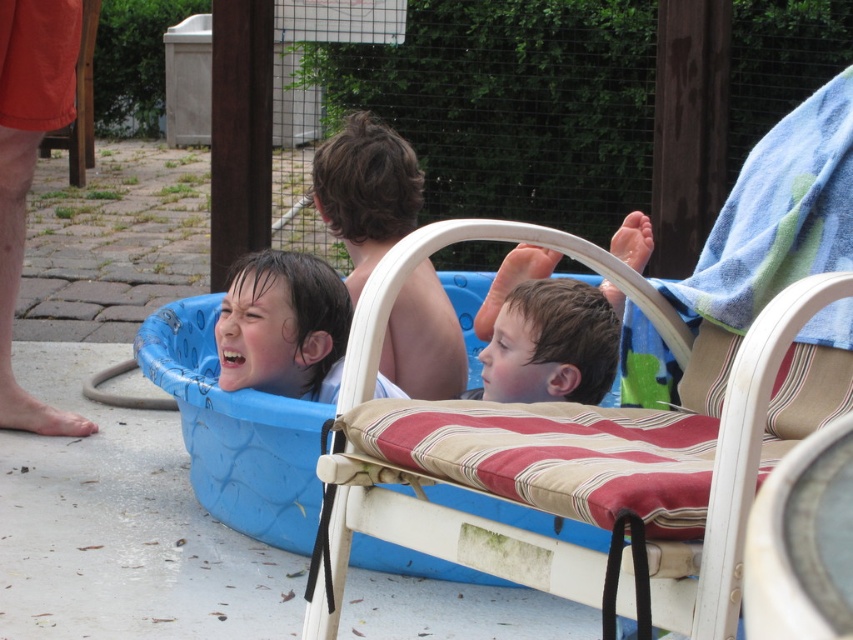
Question: Does shiny brown hair at center appear on the left side of wet brown hair at center?

Choices:
 (A) yes
 (B) no

Answer: (A)

Question: Can you confirm if shiny brown hair at center is positioned below wet brown hair at center?

Choices:
 (A) yes
 (B) no

Answer: (B)

Question: Which is farther from the shiny brown hair at center?

Choices:
 (A) wet brown hair at center
 (B) white striped cushioned beach chair at center

Answer: (B)

Question: Can you confirm if white striped cushioned beach chair at center is positioned to the right of shiny brown hair at center?

Choices:
 (A) no
 (B) yes

Answer: (B)

Question: Which of the following is the closest to the observer?

Choices:
 (A) (637, 241)
 (B) (355, 314)

Answer: (B)

Question: Which point is farther from the camera taking this photo?

Choices:
 (A) (537, 250)
 (B) (433, 300)
 (C) (721, 552)

Answer: (B)